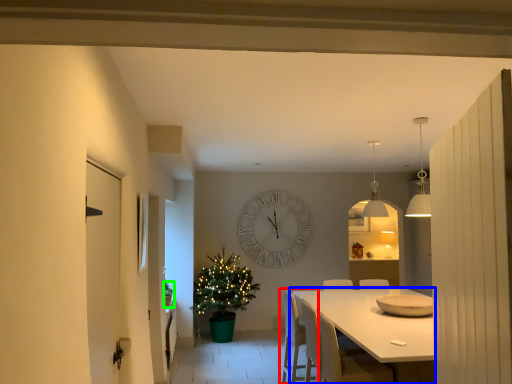
Question: Which object is the closest to the chair (highlighted by a red box)? Choose among these: kitchen & dining room table (highlighted by a blue box) or houseplant (highlighted by a green box).

Choices:
 (A) kitchen & dining room table
 (B) houseplant

Answer: (A)